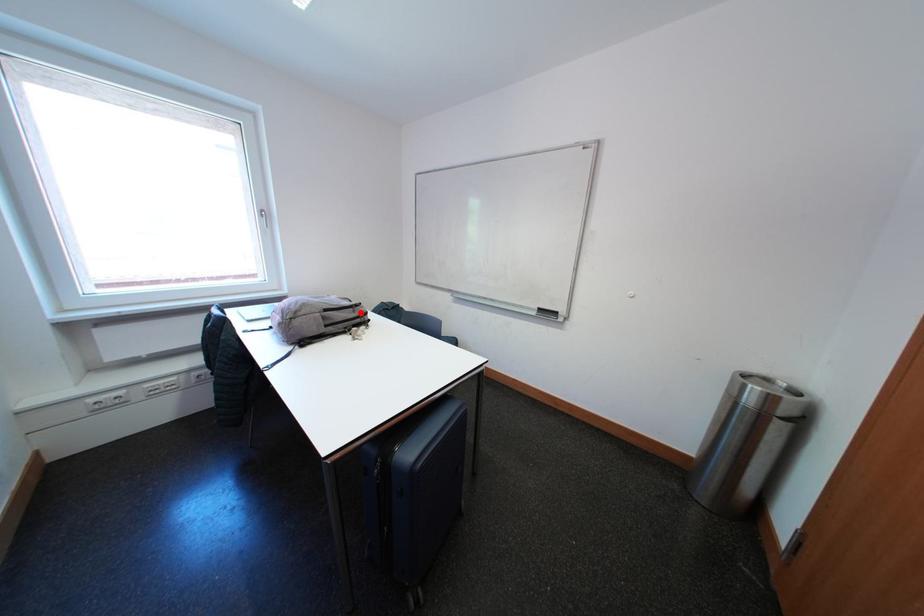
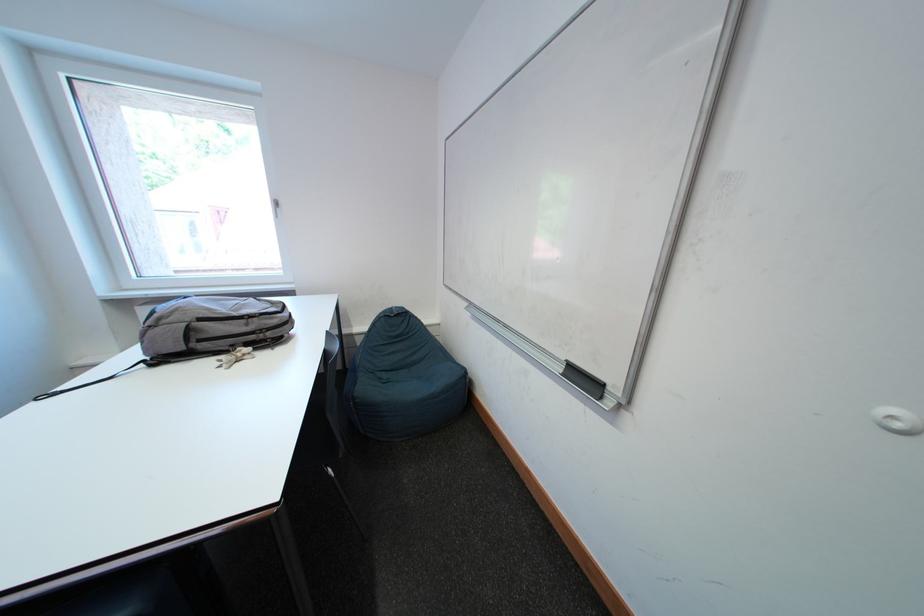
Find the pixel in the second image that matches the highlighted location in the first image.

(252, 325)